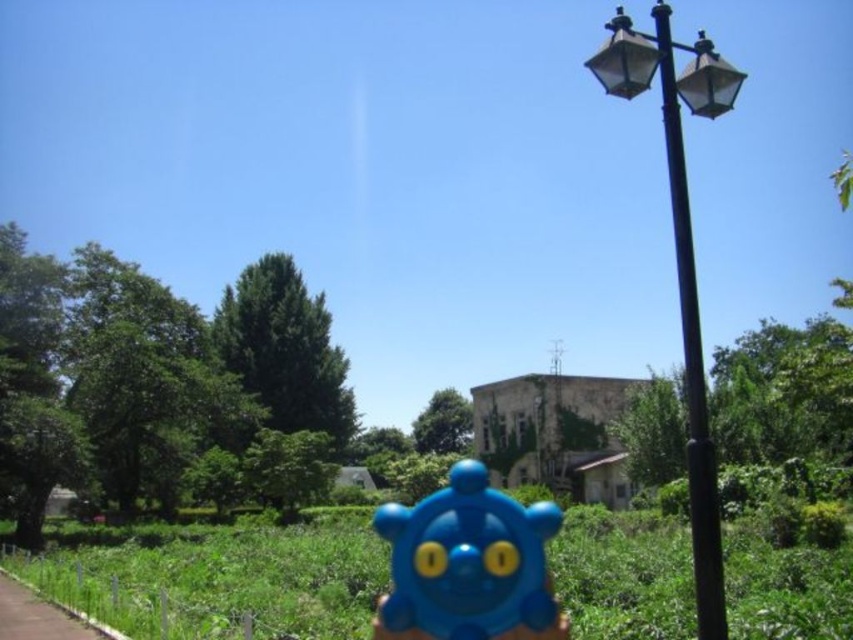
Question: Which object is positioned farthest from the blue matte toy at center?

Choices:
 (A) black metal pole at right
 (B) brown asphalt pavement at lower left

Answer: (A)

Question: Which point is farther from the camera taking this photo?

Choices:
 (A) (704, 500)
 (B) (602, 65)
 (C) (49, 602)

Answer: (C)

Question: Does blue matte toy at center appear on the right side of black metal pole at right?

Choices:
 (A) no
 (B) yes

Answer: (A)

Question: Estimate the real-world distances between objects in this image. Which object is farther from the brown asphalt pavement at lower left?

Choices:
 (A) blue matte toy at center
 (B) black metal lamp post at right

Answer: (B)

Question: From the image, what is the correct spatial relationship of blue matte toy at center in relation to black metal pole at right?

Choices:
 (A) right
 (B) left

Answer: (B)

Question: Is blue matte toy at center smaller than black metal pole at right?

Choices:
 (A) yes
 (B) no

Answer: (A)